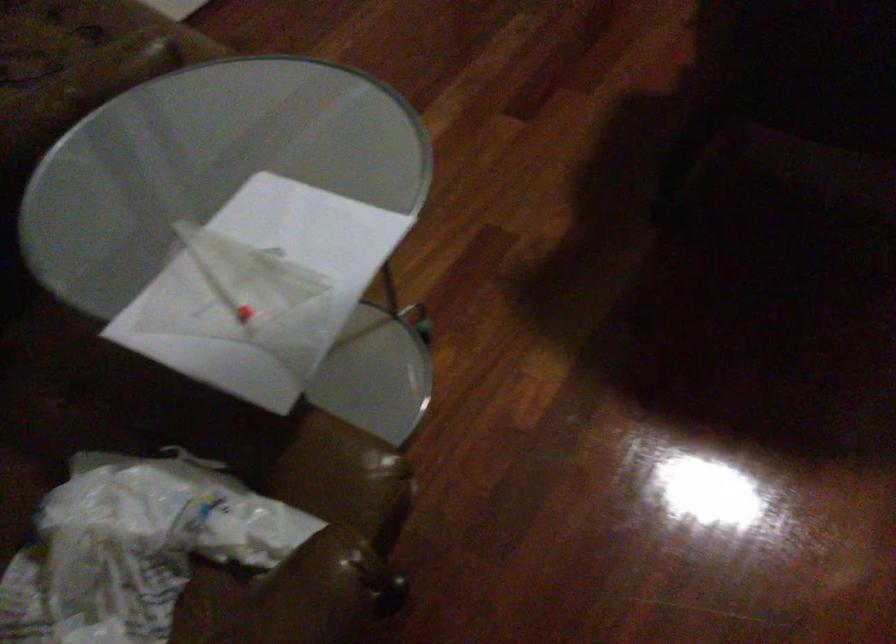
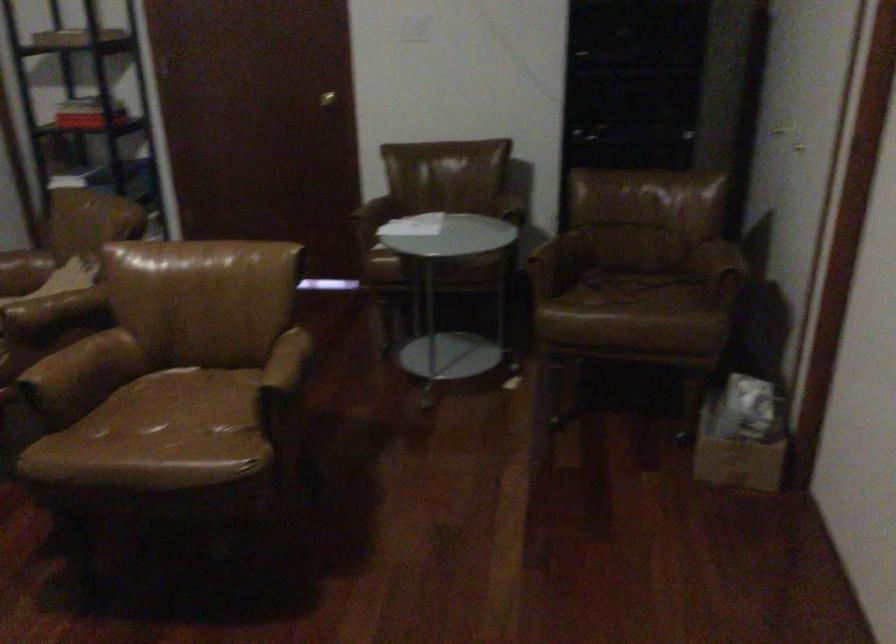
Question: I am providing you with two images of the same scene from different viewpoints. Please identify which objects are invisible in image2.

Choices:
 (A) green bin handle
 (B) chair armrest
 (C) brown chair sitting surface
 (D) crumpled plastic bag

Answer: (D)